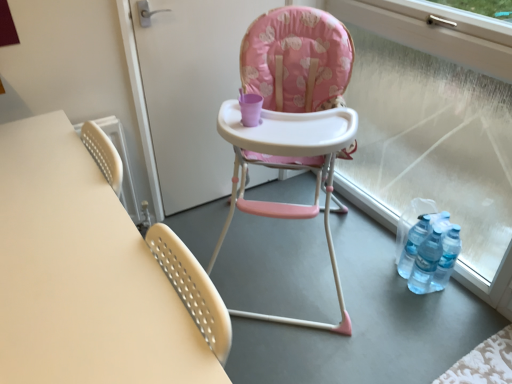
At what (x,y) coordinates should I click in order to perform the action: click on vacant space in between pink fabric highchair at center and transparent glass window at right. Please return your answer as a coordinate pair (x, y). The width and height of the screenshot is (512, 384). Looking at the image, I should click on (375, 269).